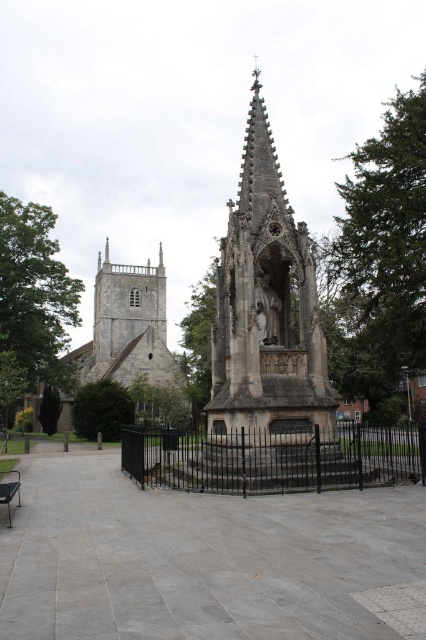
In the scene shown: Is black metal fence at center wider than polished stone statue at center?

Yes, black metal fence at center is wider than polished stone statue at center.

Does black metal fence at center lie in front of polished stone statue at center?

Yes, it is in front of polished stone statue at center.

Which is in front, point (334, 465) or point (256, 275)?

Point (334, 465)

Where is `black metal fence at center`? black metal fence at center is located at coordinates pyautogui.click(x=273, y=458).

Is point (290, 488) closer to viewer compared to point (13, 488)?

That is False.

Does point (336, 458) come in front of point (17, 504)?

No, it is behind (17, 504).

This screenshot has width=426, height=640. Find the location of `black metal fence at center`. black metal fence at center is located at coordinates (273, 458).

Is stone church at center to the right of polished stone statue at center from the viewer's perspective?

No, stone church at center is not to the right of polished stone statue at center.

Between stone church at center and polished stone statue at center, which one is positioned higher?

polished stone statue at center is higher up.

Who is more distant from viewer, (123, 316) or (278, 340)?

Point (123, 316)

This screenshot has width=426, height=640. What are the coordinates of `stone church at center` in the screenshot? It's located at (132, 337).